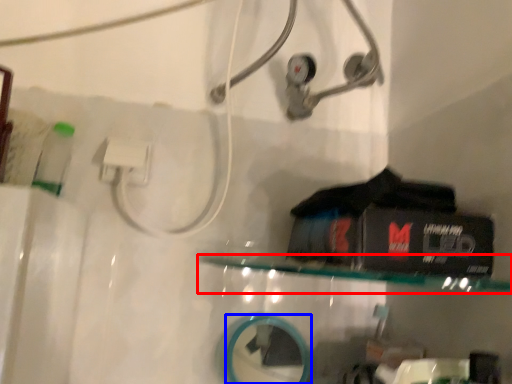
Question: Which object is closer to the camera taking this photo, shelf (highlighted by a red box) or mirror (highlighted by a blue box)?

Choices:
 (A) shelf
 (B) mirror

Answer: (A)